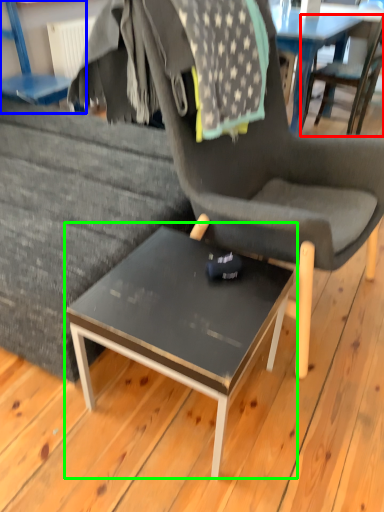
Question: Estimate the real-world distances between objects in this image. Which object is closer to chair (highlighted by a red box), chair (highlighted by a blue box) or coffee table (highlighted by a green box)?

Choices:
 (A) chair
 (B) coffee table

Answer: (A)